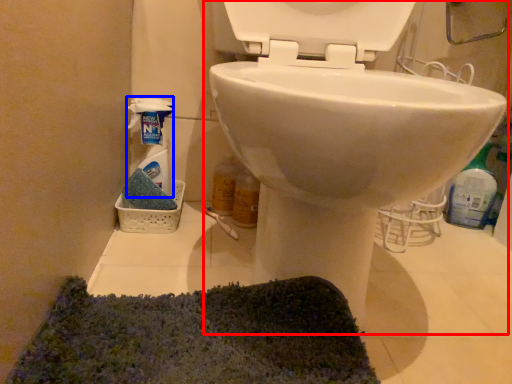
Question: Which of the following is the farthest to the observer, toilet (highlighted by a red box) or cleaning product (highlighted by a blue box)?

Choices:
 (A) toilet
 (B) cleaning product

Answer: (B)